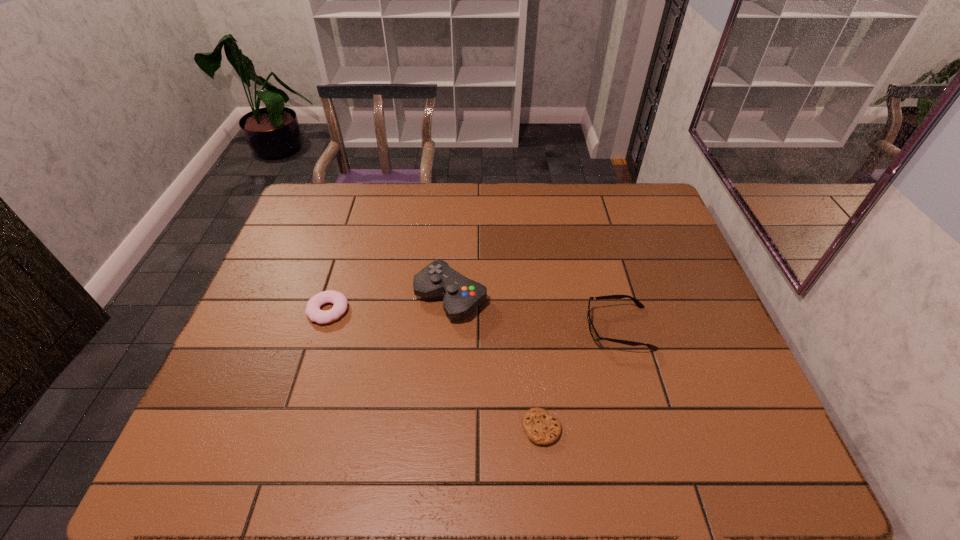
Where is `the tallest object`? the tallest object is located at coordinates (461, 296).

The image size is (960, 540). I want to click on control, so click(x=461, y=296).

The height and width of the screenshot is (540, 960). Find the location of `the third shortest object`. the third shortest object is located at coordinates (593, 332).

I want to click on spectacles, so click(x=593, y=332).

In order to click on doughnut in this screenshot , I will do `click(340, 302)`.

Where is `the third tallest object`? Image resolution: width=960 pixels, height=540 pixels. the third tallest object is located at coordinates (340, 302).

I want to click on the second object from right to left, so click(542, 429).

Locate an element on the screen. cookie is located at coordinates (542, 429).

You are a GUI agent. You are given a task and a screenshot of the screen. Output one action in this format:
    pyautogui.click(x=<x>, y=<y>)
    Task: Click on the vacant space situated on the left of the tallest object
    The width and height of the screenshot is (960, 540).
    Given the screenshot: What is the action you would take?
    pyautogui.click(x=328, y=297)

You are a GUI agent. You are given a task and a screenshot of the screen. Output one action in this format:
    pyautogui.click(x=<x>, y=<y>)
    Task: Click on the vacant region located on the front-facing side of the spectacles
    
    Given the screenshot: What is the action you would take?
    pyautogui.click(x=560, y=328)